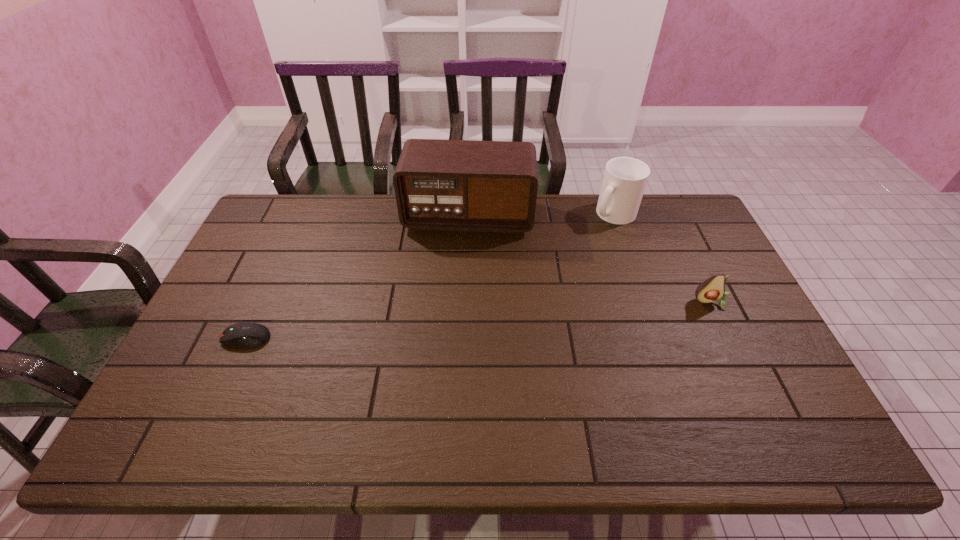
The width and height of the screenshot is (960, 540). Find the location of `vacant region between the second object from right to left and the radio receiver`. vacant region between the second object from right to left and the radio receiver is located at coordinates (541, 215).

Locate an element on the screen. unoccupied area between the third farthest object and the tallest object is located at coordinates (590, 259).

You are a GUI agent. You are given a task and a screenshot of the screen. Output one action in this format:
    pyautogui.click(x=<x>, y=<y>)
    Task: Click on the free area in between the leftmost object and the second tallest object
    
    Given the screenshot: What is the action you would take?
    pyautogui.click(x=430, y=276)

Locate an element on the screen. The height and width of the screenshot is (540, 960). vacant point located between the leftmost object and the second shortest object is located at coordinates (479, 320).

The width and height of the screenshot is (960, 540). I want to click on empty space that is in between the mug and the shortest object, so click(x=430, y=276).

This screenshot has width=960, height=540. I want to click on object that ranks as the third closest to the nearest object, so click(713, 289).

At what (x,y) coordinates should I click in order to perform the action: click on object that is the third closest one to the mug. Please return your answer as a coordinate pair (x, y). Looking at the image, I should click on (248, 334).

The width and height of the screenshot is (960, 540). Identify the location of free space that satisfies the following two spatial constraints: 1. on the back side of the mug; 2. on the right side of the radio receiver. (468, 214).